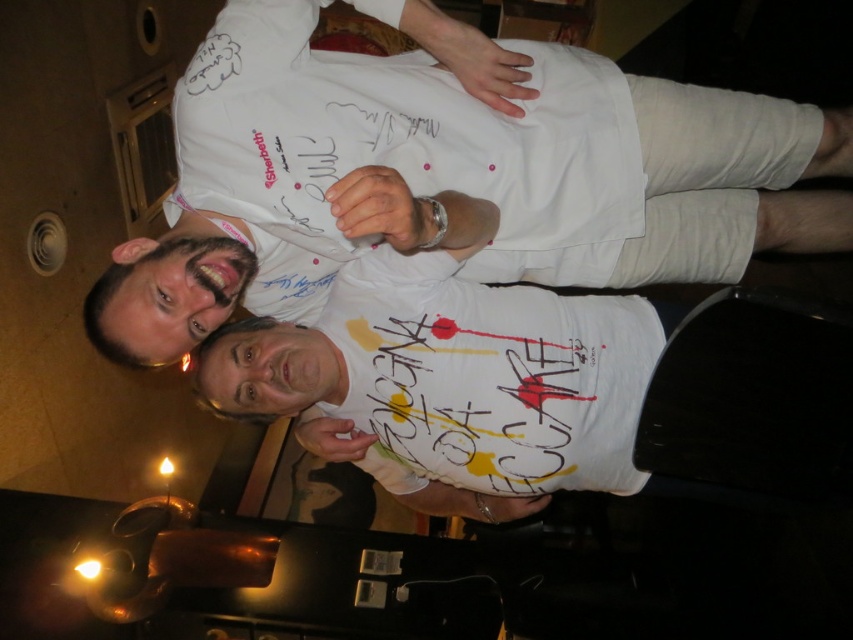
Question: Is white matte t-shirt at upper center wider than white fabric shirt at center?

Choices:
 (A) yes
 (B) no

Answer: (A)

Question: Which of the following is the farthest from the observer?

Choices:
 (A) white matte t-shirt at center
 (B) white fabric shirt at center

Answer: (B)

Question: Estimate the real-world distances between objects in this image. Which object is closer to the white matte t-shirt at upper center?

Choices:
 (A) white matte t-shirt at center
 (B) white fabric shirt at center

Answer: (A)

Question: Does white matte t-shirt at upper center appear under white matte t-shirt at center?

Choices:
 (A) no
 (B) yes

Answer: (A)

Question: Which object is positioned farthest from the white matte t-shirt at upper center?

Choices:
 (A) white fabric shirt at center
 (B) white matte t-shirt at center

Answer: (A)

Question: Is white matte t-shirt at upper center above white fabric shirt at center?

Choices:
 (A) no
 (B) yes

Answer: (B)